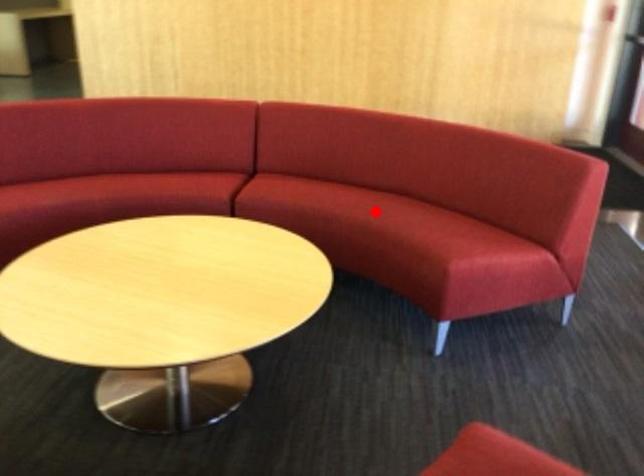
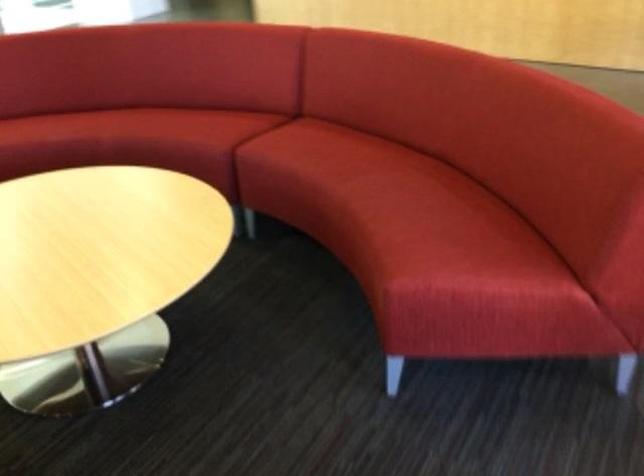
Question: I am providing you with two images of the same scene from different viewpoints. A red point is shown in image1. For the corresponding object point in image2, is it positioned nearer or farther from the camera?

Choices:
 (A) Nearer
 (B) Farther

Answer: (A)